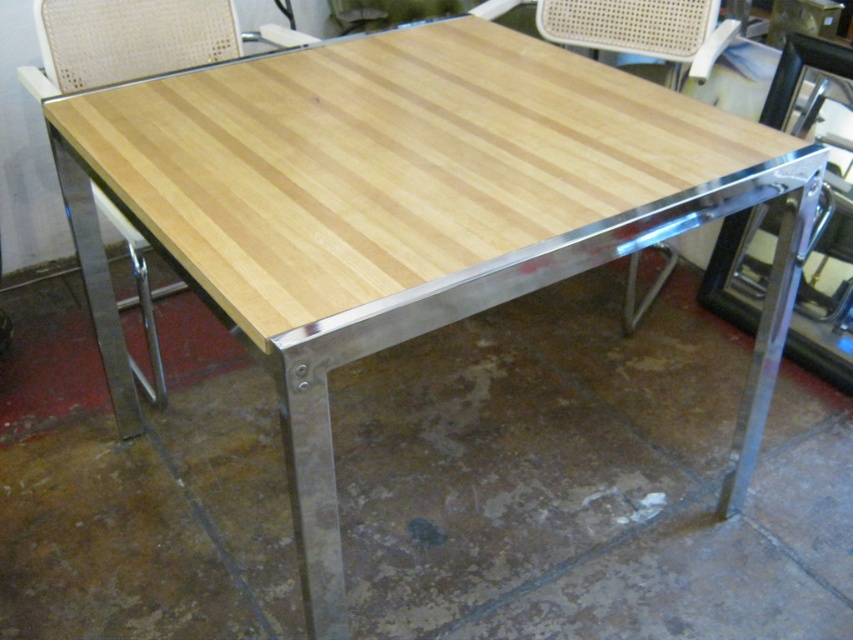
You are standing in a furniture store and see the woven fabric chair at upper center and the wooden at center. Which object is nearer to you?

The woven fabric chair at upper center is closer to the viewer than the wooden at center.

You are a customer in a furniture store looking at the wooden at center and the woven beige chair at upper center. Which object is positioned higher from the floor?

The wooden at center is located above the woven beige chair at upper center, so it is positioned higher from the floor.

You are standing in a furniture store and want to measure the distance between you and a specific point on the table. The point is labeled as point (27,90). Can you determine how far you are from this point?

The point (27,90) is 5.68 feet away from the camera, so you are 5.68 feet away from this point.